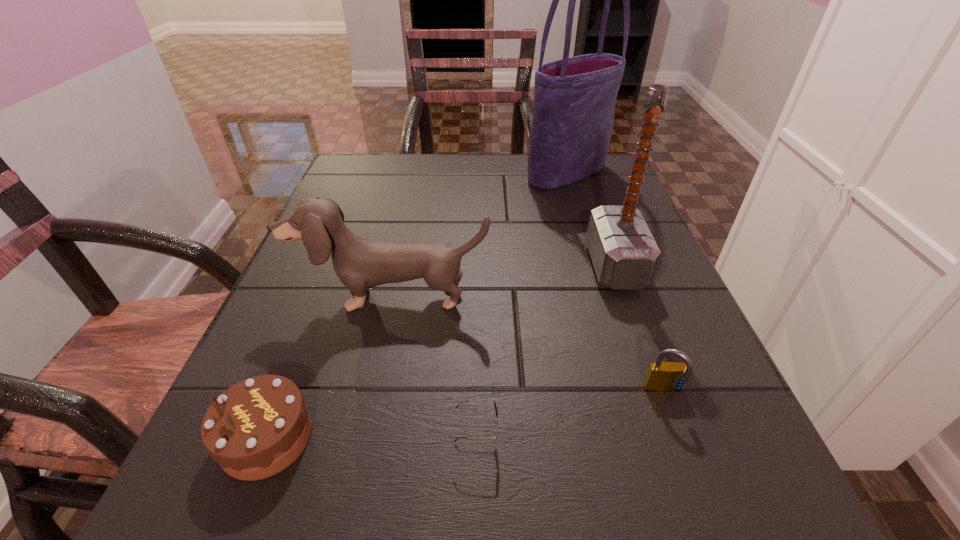
You are a GUI agent. You are given a task and a screenshot of the screen. Output one action in this format:
    pyautogui.click(x=<x>, y=<y>)
    Task: Click on the vacant position located on the striking surface of the hammer
    This screenshot has height=540, width=960.
    Given the screenshot: What is the action you would take?
    pyautogui.click(x=489, y=266)

Image resolution: width=960 pixels, height=540 pixels. Find the location of `vacant position located 0.310m at the face of the puppy`. vacant position located 0.310m at the face of the puppy is located at coordinates (343, 515).

I want to click on vacant space situated on the side with the combination dials of the padlock, so click(704, 501).

The image size is (960, 540). I want to click on free region located 0.280m on the back of the chocolate cake, so 333,269.

Identify the location of free point located 0.240m in front of the lenses of the sunglasses. (688, 438).

At what (x,y) coordinates should I click in order to perform the action: click on object present at the far edge. Please return your answer as a coordinate pair (x, y). Looking at the image, I should click on [574, 98].

Locate an element on the screen. This screenshot has width=960, height=540. chocolate cake that is at the near edge is located at coordinates (258, 427).

Find the location of a particular element. Image resolution: width=960 pixels, height=540 pixels. sunglasses present at the near edge is located at coordinates (496, 406).

Find the location of a particular element. The width and height of the screenshot is (960, 540). puppy that is at the left edge is located at coordinates (359, 263).

Locate an element on the screen. chocolate cake at the left edge is located at coordinates (258, 427).